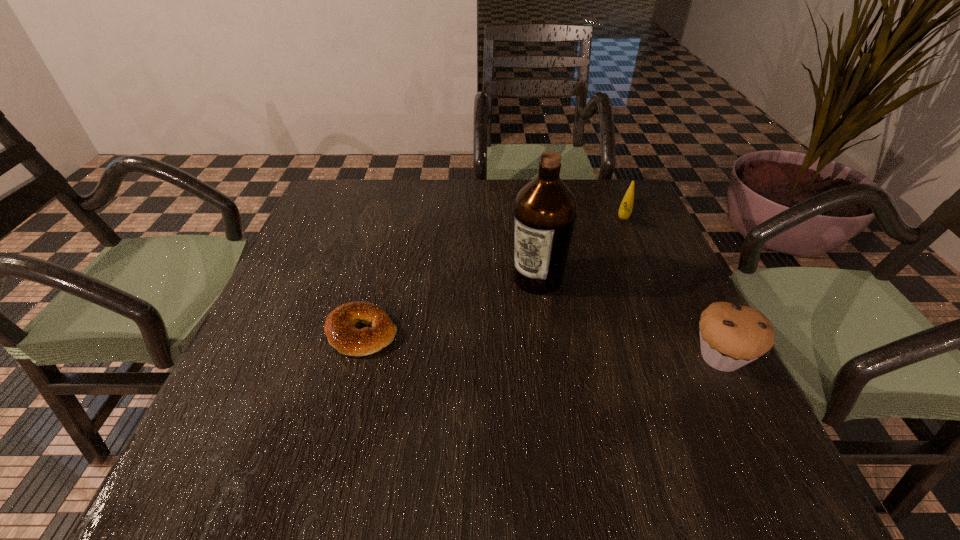
Where is `object that is the closest to the tallest object`? This screenshot has height=540, width=960. object that is the closest to the tallest object is located at coordinates (625, 210).

This screenshot has height=540, width=960. I want to click on vacant space that satisfies the following two spatial constraints: 1. on the front side of the second tallest object; 2. on the left side of the bagel, so click(x=355, y=357).

You are a GUI agent. You are given a task and a screenshot of the screen. Output one action in this format:
    pyautogui.click(x=<x>, y=<y>)
    Task: Click on the free space that satisfies the following two spatial constraints: 1. on the back side of the second object from left to right; 2. on the left side of the shortest object
    
    Given the screenshot: What is the action you would take?
    pyautogui.click(x=376, y=278)